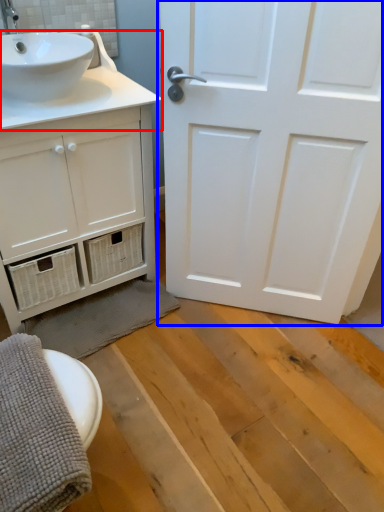
Question: Which point is further to the camera, counter top (highlighted by a red box) or door (highlighted by a blue box)?

Choices:
 (A) counter top
 (B) door

Answer: (A)